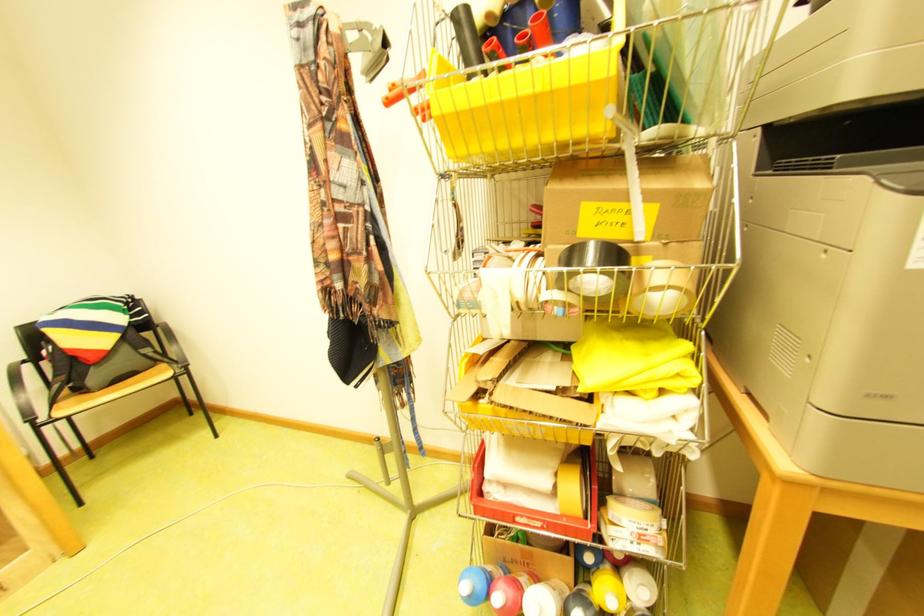
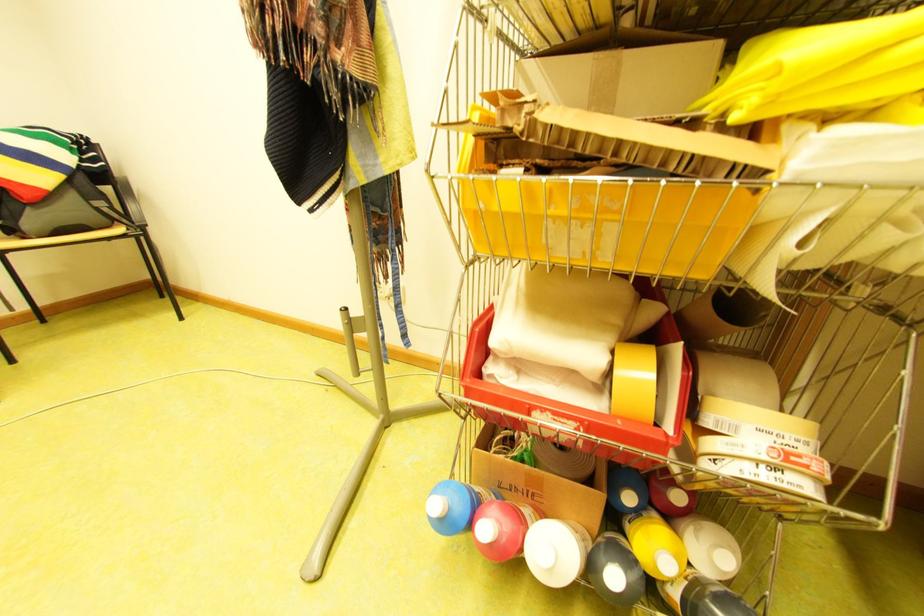
Locate, in the second image, the point that corresponds to point 642,523 in the first image.

(772, 432)